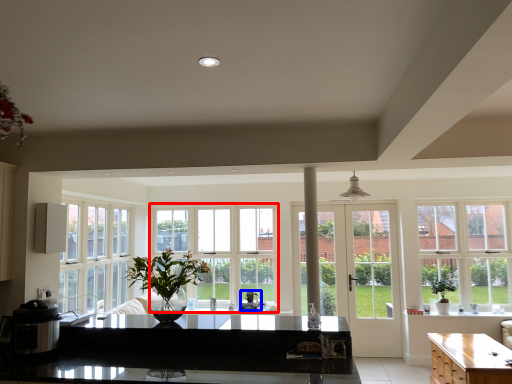
Question: Which of the following is the closest to the observer, window (highlighted by a red box) or appliance (highlighted by a blue box)?

Choices:
 (A) window
 (B) appliance

Answer: (B)